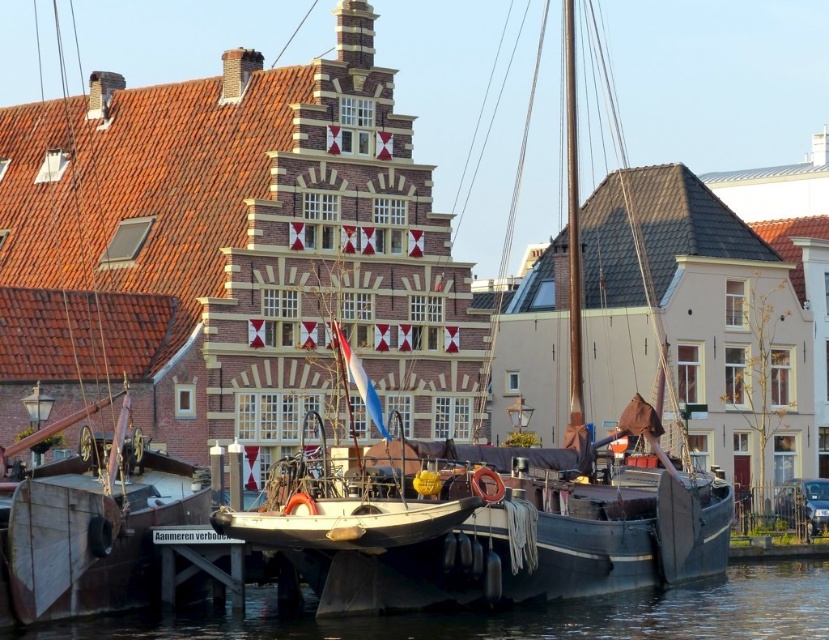
Question: Is wooden boat at left positioned in front of transparent water at lower center?

Choices:
 (A) no
 (B) yes

Answer: (B)

Question: Among these points, which one is farthest from the camera?

Choices:
 (A) (153, 337)
 (B) (590, 429)
 (C) (81, 632)

Answer: (A)

Question: Which of these objects is positioned closest to the wooden sailboat at center?

Choices:
 (A) transparent water at lower center
 (B) wooden boat at left

Answer: (A)

Question: Which of the following is the farthest from the observer?

Choices:
 (A) (532, 525)
 (B) (110, 104)
 (C) (303, 620)

Answer: (B)

Question: Can you confirm if wooden sailboat at center is wider than transparent water at lower center?

Choices:
 (A) yes
 (B) no

Answer: (B)

Question: Does wooden boat at left have a lesser width compared to wooden sailboat at center?

Choices:
 (A) no
 (B) yes

Answer: (B)